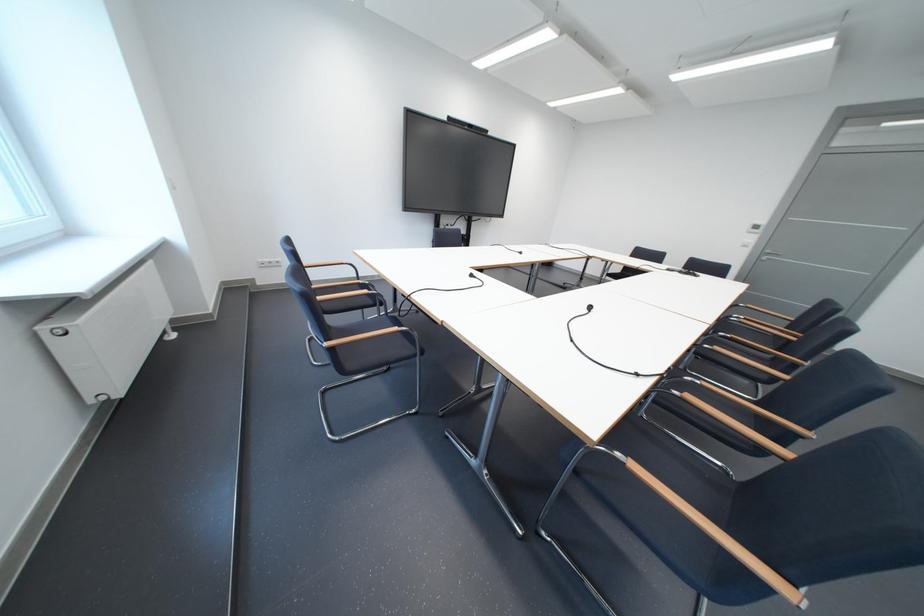
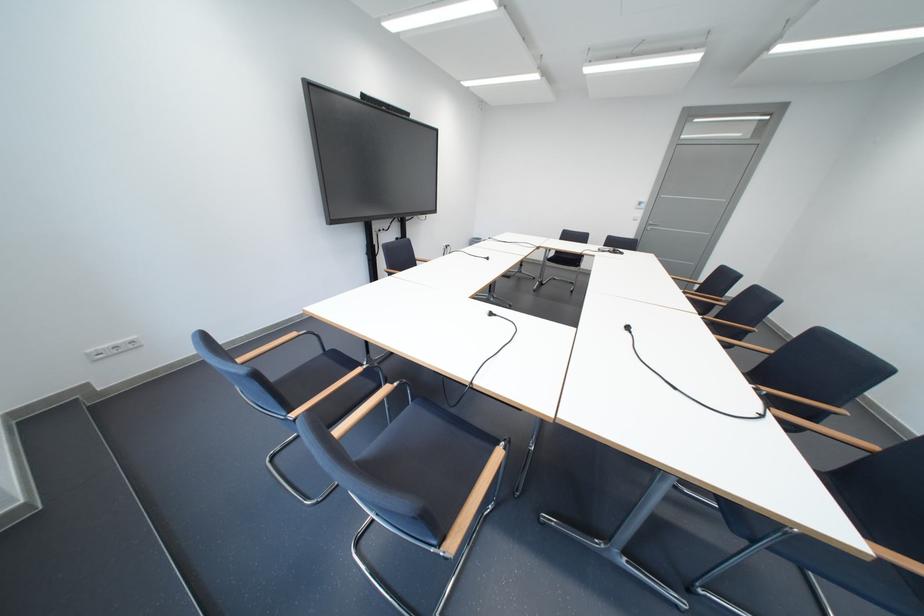
Find the pixel in the second image that matches point (775, 256) in the first image.

(660, 227)